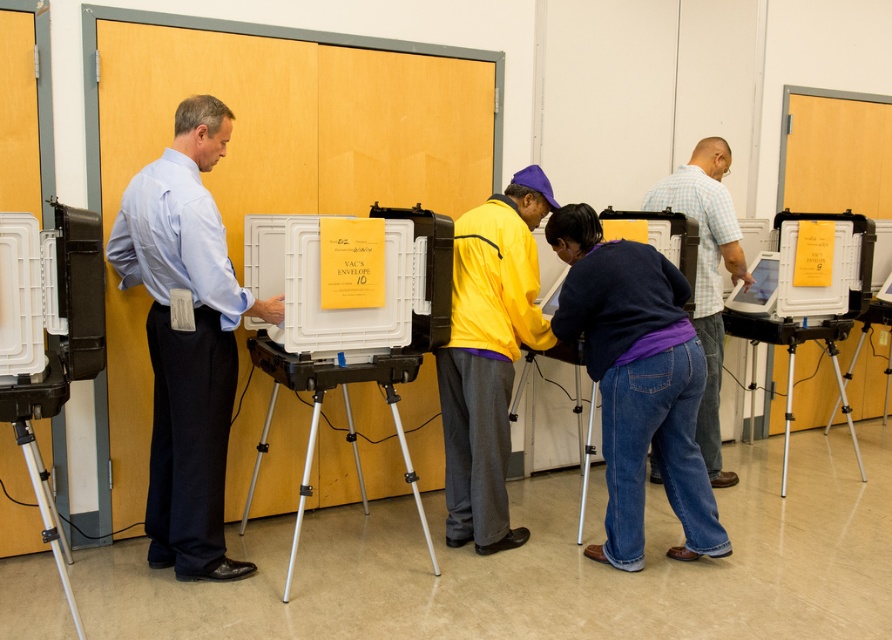
Does light blue shirt at left lie behind denim jeans at center?

No.

Image resolution: width=892 pixels, height=640 pixels. Describe the element at coordinates (187, 339) in the screenshot. I see `light blue shirt at left` at that location.

The image size is (892, 640). In order to click on light blue shirt at left in this screenshot , I will do `click(187, 339)`.

Who is positioned more to the left, matte purple sweater at center or silver metallic tripod at lower left?

silver metallic tripod at lower left

From the picture: Can you confirm if matte purple sweater at center is wider than silver metallic tripod at lower left?

Yes, matte purple sweater at center is wider than silver metallic tripod at lower left.

Identify the location of matte purple sweater at center. Image resolution: width=892 pixels, height=640 pixels. (707, 273).

Locate an element on the screen. The height and width of the screenshot is (640, 892). matte purple sweater at center is located at coordinates click(x=707, y=273).

Is light blue shirt at left smaller than silver metallic tripod at lower left?

No.

Between light blue shirt at left and silver metallic tripod at lower left, which one appears on the right side from the viewer's perspective?

light blue shirt at left

Between point (164, 364) and point (35, 476), which one is positioned behind?

Positioned behind is point (164, 364).

You are a GUI agent. You are given a task and a screenshot of the screen. Output one action in this format:
    pyautogui.click(x=<x>, y=<y>)
    Task: Click on the light blue shirt at left
    The height and width of the screenshot is (640, 892).
    Given the screenshot: What is the action you would take?
    pyautogui.click(x=187, y=339)